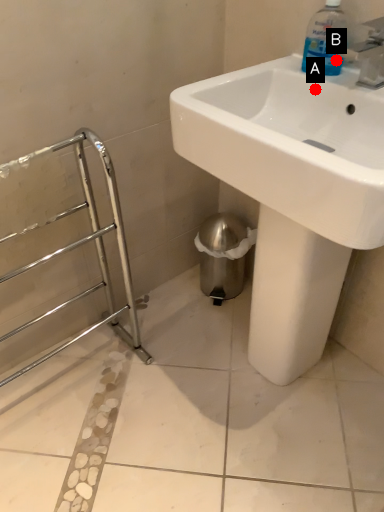
Question: Two points are circled on the image, labeled by A and B beside each circle. Which point appears farthest from the camera in this image?

Choices:
 (A) A is further
 (B) B is further

Answer: (B)